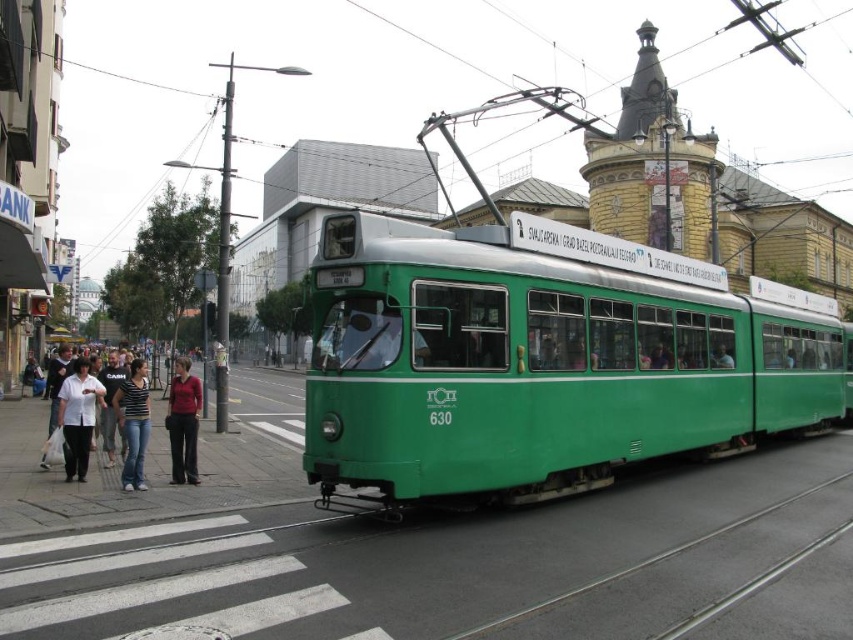
Question: Can you confirm if matte white shirt at lower left is thinner than matte red shirt at center?

Choices:
 (A) no
 (B) yes

Answer: (B)

Question: Which object is farther from the camera taking this photo?

Choices:
 (A) matte white shirt at lower left
 (B) matte red shirt at center

Answer: (B)

Question: Where is matte white shirt at lower left located in relation to matte red shirt at center in the image?

Choices:
 (A) below
 (B) above

Answer: (B)

Question: Which of the following is the farthest from the observer?

Choices:
 (A) (180, 435)
 (B) (129, 449)
 (C) (97, 380)
 (D) (86, 401)

Answer: (C)

Question: Is white cotton shirt at lower left smaller than striped t-shirt at center?

Choices:
 (A) no
 (B) yes

Answer: (A)

Question: Estimate the real-world distances between objects in this image. Which object is closer to the striped t-shirt at center?

Choices:
 (A) matte white shirt at lower left
 (B) matte red shirt at center

Answer: (A)